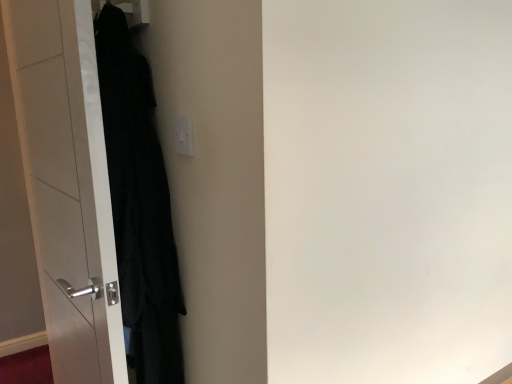
Question: Should I look upward or downward to see white glossy door at left?

Choices:
 (A) down
 (B) up

Answer: (A)

Question: Considering the relative sizes of white plastic electric outlet at upper center and black matte coat at left in the image provided, is white plastic electric outlet at upper center thinner than black matte coat at left?

Choices:
 (A) yes
 (B) no

Answer: (A)

Question: From a real-world perspective, is white plastic electric outlet at upper center positioned under black matte coat at left based on gravity?

Choices:
 (A) no
 (B) yes

Answer: (A)

Question: Is white plastic electric outlet at upper center positioned far away from black matte coat at left?

Choices:
 (A) yes
 (B) no

Answer: (B)

Question: Can you confirm if white plastic electric outlet at upper center is bigger than black matte coat at left?

Choices:
 (A) no
 (B) yes

Answer: (A)

Question: Is white plastic electric outlet at upper center at the right side of black matte coat at left?

Choices:
 (A) no
 (B) yes

Answer: (B)

Question: Is white plastic electric outlet at upper center shorter than black matte coat at left?

Choices:
 (A) yes
 (B) no

Answer: (A)

Question: Does white glossy door at left have a lesser height compared to black matte coat at left?

Choices:
 (A) no
 (B) yes

Answer: (A)

Question: From the image's perspective, is white glossy door at left below black matte coat at left?

Choices:
 (A) yes
 (B) no

Answer: (A)

Question: Is white glossy door at left further to camera compared to black matte coat at left?

Choices:
 (A) yes
 (B) no

Answer: (B)

Question: Is white glossy door at left bigger than black matte coat at left?

Choices:
 (A) yes
 (B) no

Answer: (A)

Question: Would you say black matte coat at left is part of white glossy door at left's contents?

Choices:
 (A) yes
 (B) no

Answer: (B)

Question: Is white glossy door at left oriented towards black matte coat at left?

Choices:
 (A) yes
 (B) no

Answer: (A)

Question: Considering the relative sizes of black matte coat at left and white glossy door at left in the image provided, is black matte coat at left wider than white glossy door at left?

Choices:
 (A) yes
 (B) no

Answer: (A)